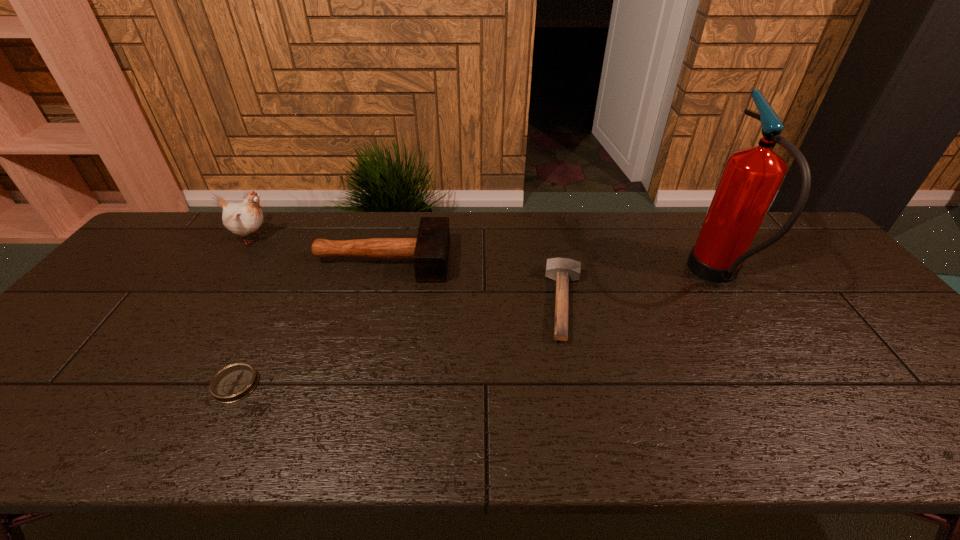
At what (x,y) coordinates should I click in order to perform the action: click on unoccupied position between the shortest object and the fire extinguisher. Please return your answer as a coordinate pair (x, y). This screenshot has width=960, height=540. Looking at the image, I should click on (476, 330).

Image resolution: width=960 pixels, height=540 pixels. In order to click on free space between the compass and the second tallest object in this screenshot , I will do `click(244, 311)`.

Identify the location of blank region between the second shortest object and the third object from right to left. (474, 281).

Select which object appears as the fourth closest to the fourth object from right to left. Please provide its 2D coordinates. Your answer should be formatted as a tuple, i.e. [(x, y)], where the tuple contains the x and y coordinates of a point satisfying the conditions above.

[(752, 176)]

In order to click on object that is the third closest to the tallest object in this screenshot , I will do `click(235, 382)`.

What are the coordinates of `vacant space that satisfies the following two spatial constraints: 1. at the beak of the shorter mallet; 2. on the left side of the leftmost object` in the screenshot? It's located at (209, 303).

Locate an element on the screen. The width and height of the screenshot is (960, 540). vacant space that satisfies the following two spatial constraints: 1. on the hammer head face of the third shortest object; 2. on the back side of the second shortest object is located at coordinates (371, 303).

This screenshot has height=540, width=960. Identify the location of vacant space that satisfies the following two spatial constraints: 1. on the back side of the second shortest object; 2. at the beak of the leftmost object. (552, 237).

Identify the location of vacant point that satisfies the following two spatial constraints: 1. on the hammer head face of the left mallet; 2. on the right side of the tallest object. (378, 276).

Locate an element on the screen. vacant space that satisfies the following two spatial constraints: 1. on the hammer head face of the third tallest object; 2. on the right side of the fire extinguisher is located at coordinates (378, 276).